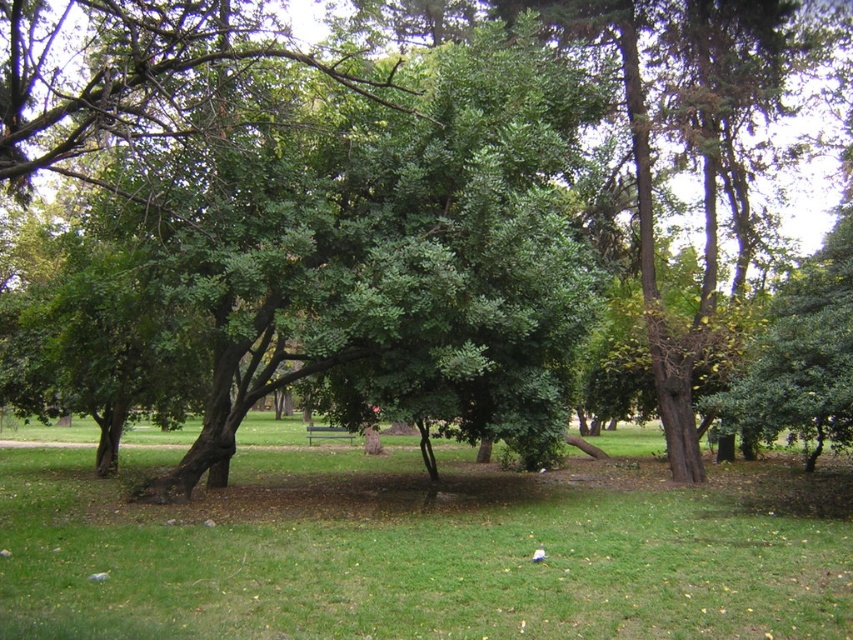
You are a visitor in the park and want to sit on the metallic silver bench at center. Are you able to see the bench from your current position standing on the green grassy at center?

The green grassy at center is in front of the metallic silver bench at center, so you are standing in front of the bench. Therefore, you can see the bench from your current position on the green grassy at center.

You are a park visitor sitting on the metallic silver bench at center. You want to place your bag on the green grassy area at center. Is the green grassy at center a suitable place to put your bag?

The green grassy at center is above the metallic silver bench at center, so placing your bag there would require it to be on the grass, which is a suitable surface for a bag.